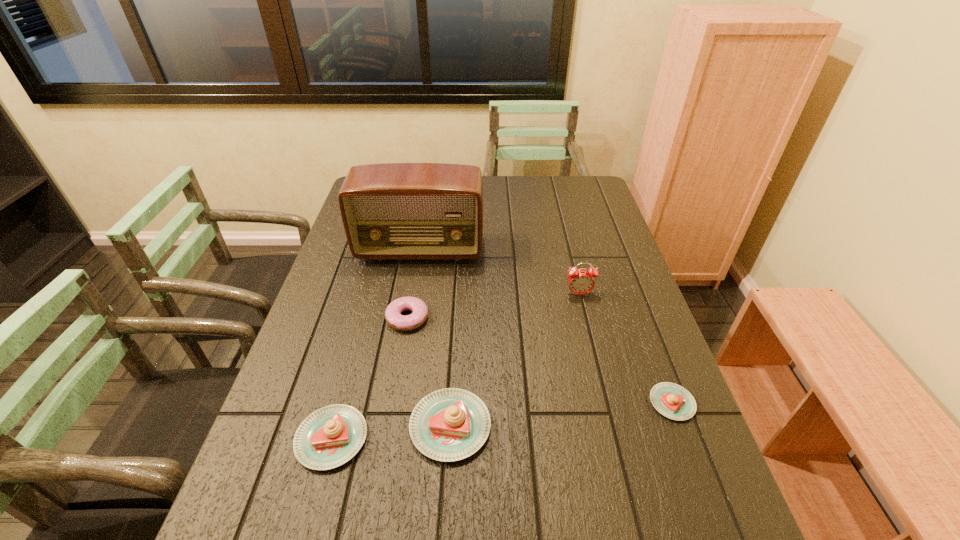
Choose which pastry is the second nearest neighbor to the radio receiver. Please provide its 2D coordinates. Your answer should be formatted as a tuple, i.e. [(x, y)], where the tuple contains the x and y coordinates of a point satisfying the conditions above.

[(329, 437)]

Locate an element on the screen. The height and width of the screenshot is (540, 960). blank area in the image that satisfies the following two spatial constraints: 1. on the front side of the shortest object; 2. on the right side of the second shortest object is located at coordinates (393, 403).

At what (x,y) coordinates should I click in order to perform the action: click on vacant area that satisfies the following two spatial constraints: 1. on the front-facing side of the farthest object; 2. on the left side of the second pastry from right to left. Please return your answer as a coordinate pair (x, y). Image resolution: width=960 pixels, height=540 pixels. Looking at the image, I should click on (391, 426).

This screenshot has height=540, width=960. I want to click on vacant space that satisfies the following two spatial constraints: 1. on the back side of the rightmost pastry; 2. on the left side of the second pastry from right to left, so click(451, 403).

Where is `free space that satisfies the following two spatial constraints: 1. on the front-facing side of the second pastry from right to left; 2. on the right side of the radio receiver`? This screenshot has width=960, height=540. free space that satisfies the following two spatial constraints: 1. on the front-facing side of the second pastry from right to left; 2. on the right side of the radio receiver is located at coordinates (391, 426).